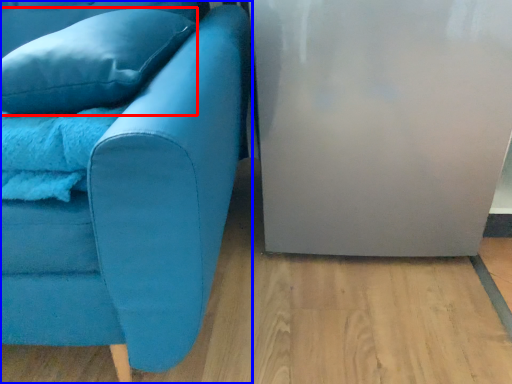
Question: Among these objects, which one is nearest to the camera, pillow (highlighted by a red box) or studio couch (highlighted by a blue box)?

Choices:
 (A) pillow
 (B) studio couch

Answer: (B)